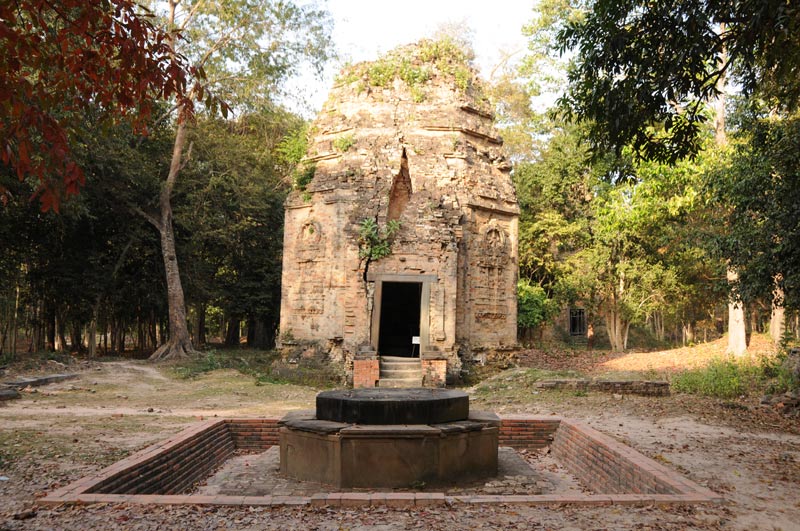
Where is `doorway`? This screenshot has width=800, height=531. doorway is located at coordinates (394, 319).